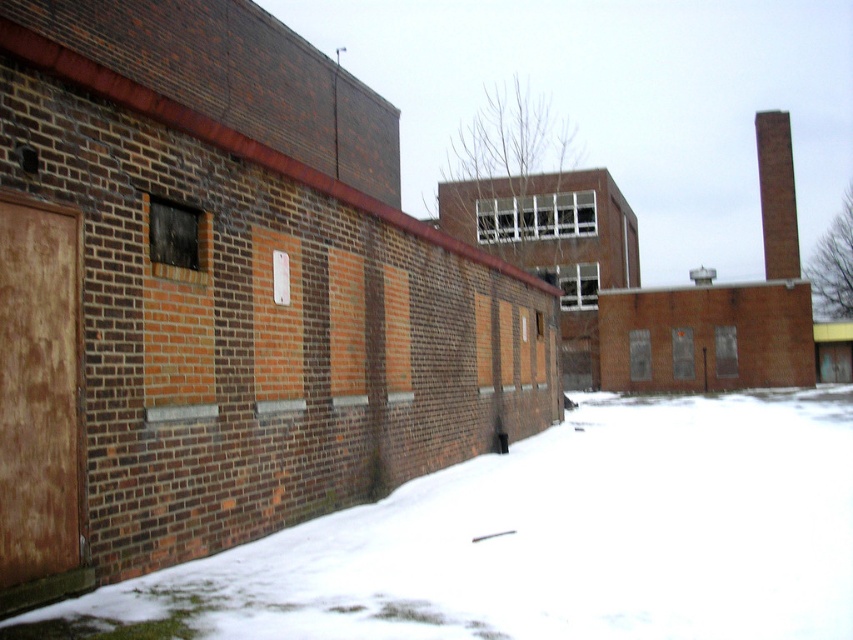
Who is more forward, (270, 586) or (776, 138)?

Point (270, 586) is in front.

Is white powdery snow at lower left below brown brick chimney at upper right?

Correct, white powdery snow at lower left is located below brown brick chimney at upper right.

The height and width of the screenshot is (640, 853). Describe the element at coordinates (552, 540) in the screenshot. I see `white powdery snow at lower left` at that location.

Where is `white powdery snow at lower left`? This screenshot has height=640, width=853. white powdery snow at lower left is located at coordinates (552, 540).